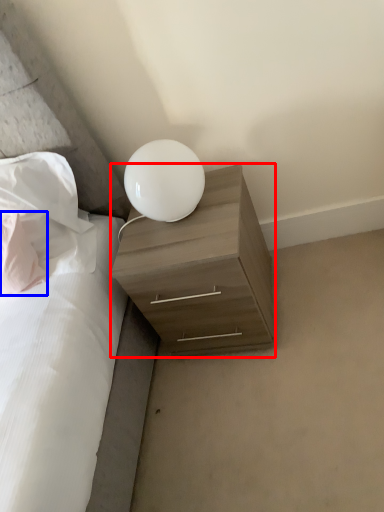
Question: Among these objects, which one is farthest to the camera, nightstand (highlighted by a red box) or pillow (highlighted by a blue box)?

Choices:
 (A) nightstand
 (B) pillow

Answer: (B)